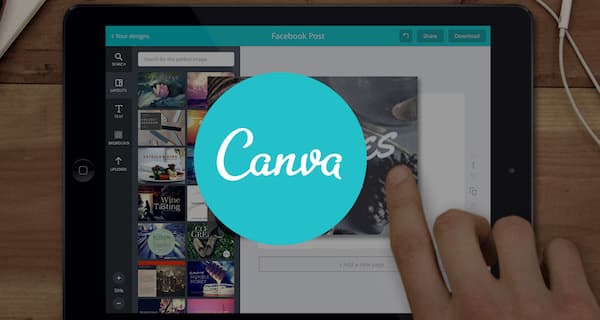
The width and height of the screenshot is (600, 320). What are the coordinates of `tablet screen` in the screenshot? It's located at (305, 66).